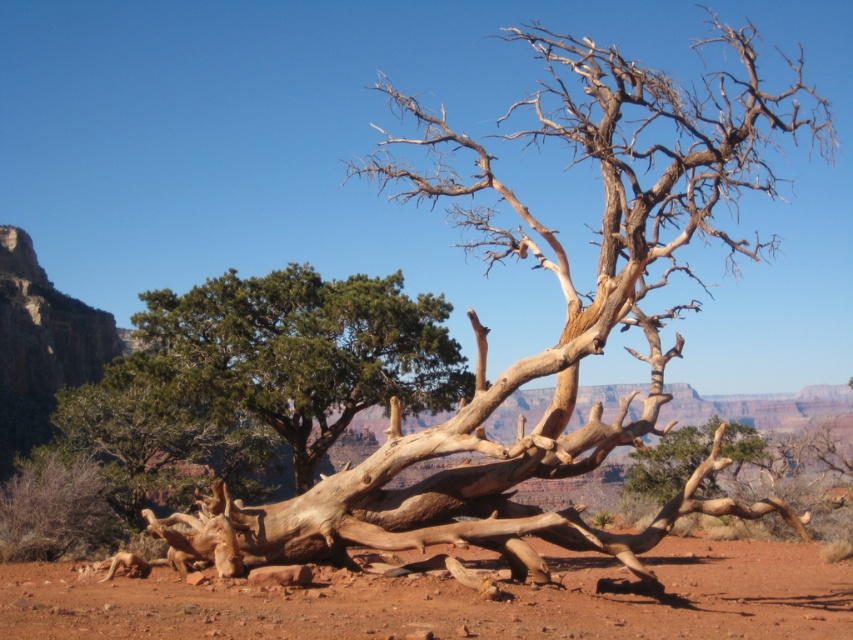
You are a hiker trying to determine which tree is wider between the green textured tree at center and the light brown wood tree at center. Based on the scene, which one has a larger width?

The light brown wood tree at center has a greater width than the green textured tree at center, so the light brown wood tree at center is wider.

Based on the photo, you are a hiker trying to navigate through the forest. You see the green textured tree at center. Can you determine its exact location in the image using coordinates?

The green textured tree at center is located at point [306,349].